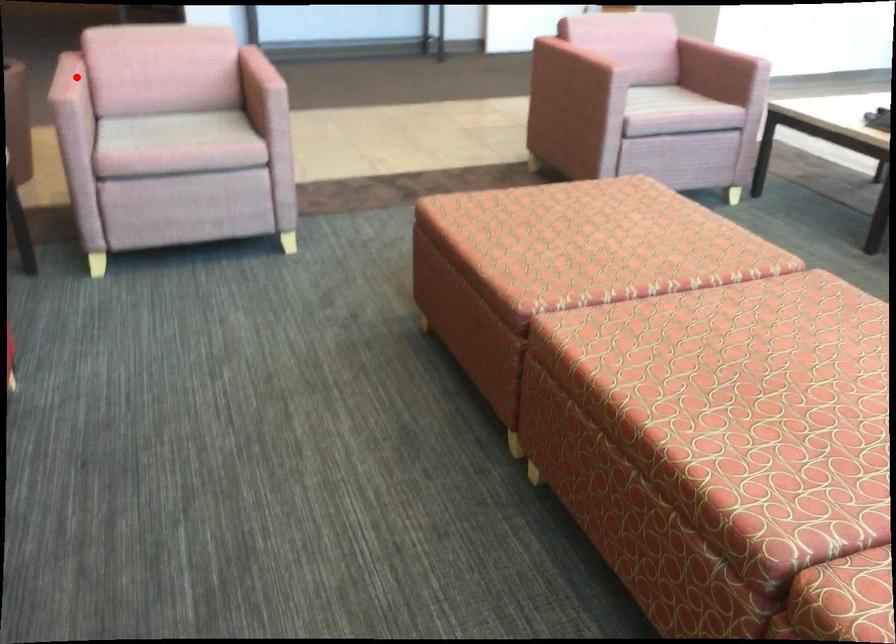
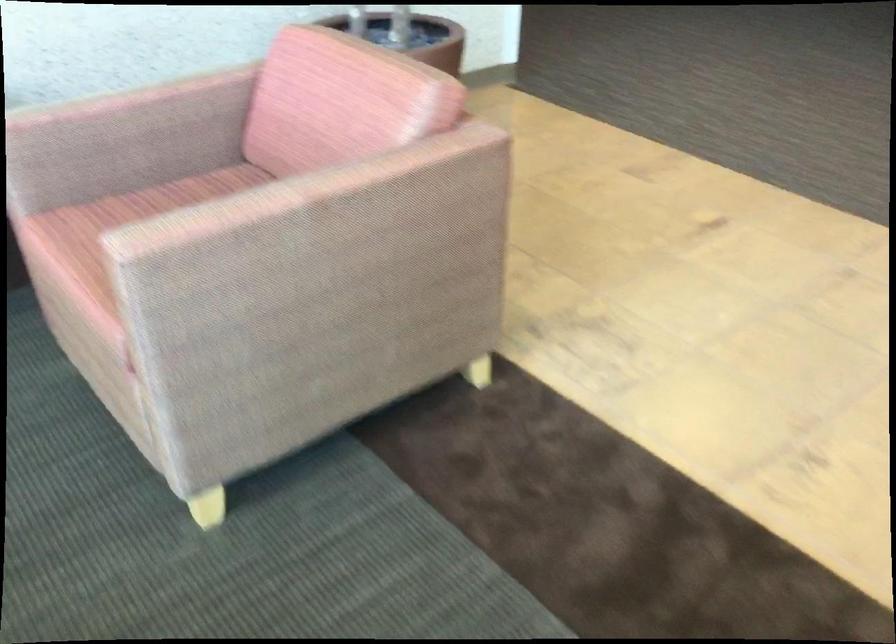
Where in the second image is the point corresponding to the highlighted location from the first image?

(121, 98)